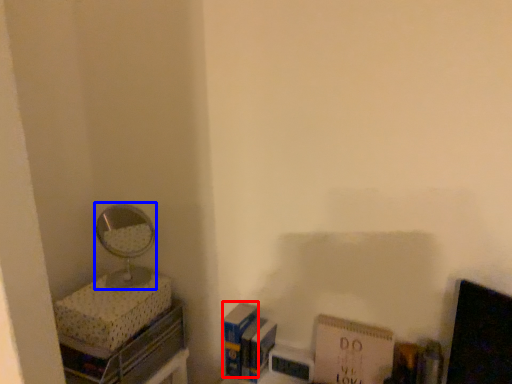
Question: Which object is closer to the camera taking this photo, paperback book (highlighted by a red box) or mirror (highlighted by a blue box)?

Choices:
 (A) paperback book
 (B) mirror

Answer: (B)